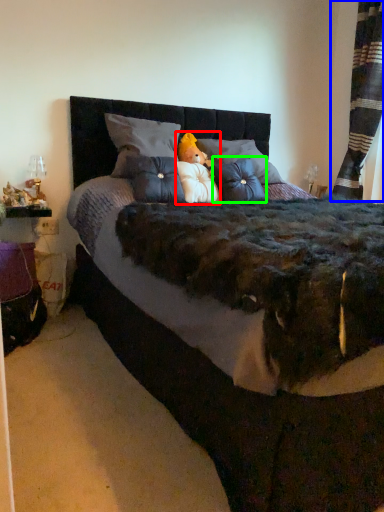
Question: Which object is the farthest from toy (highlighted by a red box)? Choose among these: curtain (highlighted by a blue box) or throw pillow (highlighted by a green box).

Choices:
 (A) curtain
 (B) throw pillow

Answer: (A)